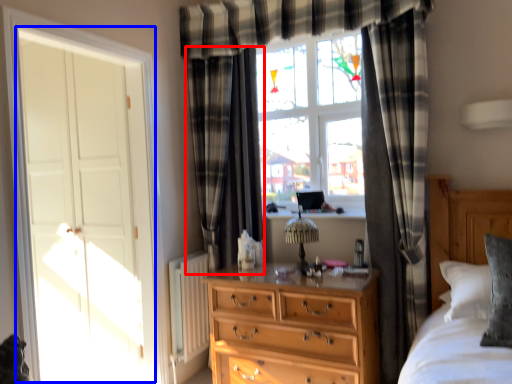
Question: Which object is closer to the camera taking this photo, curtain (highlighted by a red box) or screen door (highlighted by a blue box)?

Choices:
 (A) curtain
 (B) screen door

Answer: (B)